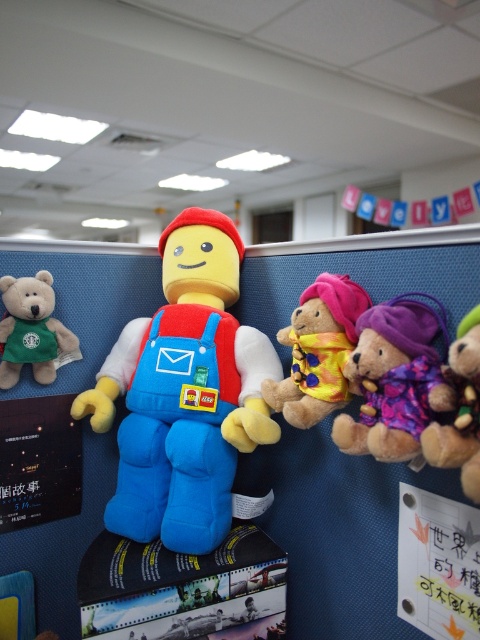
Can you confirm if fluffy yellow teddy bear at center is positioned above green fabric teddy bear at left?

No, fluffy yellow teddy bear at center is not above green fabric teddy bear at left.

The width and height of the screenshot is (480, 640). Identify the location of fluffy yellow teddy bear at center. pyautogui.click(x=317, y=349).

Find the location of a particular element. This screenshot has width=480, height=640. fluffy yellow teddy bear at center is located at coordinates (317, 349).

Is brown plush bear at right smaller than purple fuzzy teddy bear at right?

No, brown plush bear at right is not smaller than purple fuzzy teddy bear at right.

Is brown plush bear at right to the right of purple fuzzy teddy bear at right from the viewer's perspective?

Incorrect, brown plush bear at right is not on the right side of purple fuzzy teddy bear at right.

Describe the element at coordinates (395, 380) in the screenshot. This screenshot has width=480, height=640. I see `brown plush bear at right` at that location.

You are a GUI agent. You are given a task and a screenshot of the screen. Output one action in this format:
    pyautogui.click(x=<x>, y=<y>)
    Task: Click on the brown plush bear at right
    The image size is (480, 640).
    Given the screenshot: What is the action you would take?
    pyautogui.click(x=395, y=380)

From the picture: Does soft plush toy at center have a larger size compared to fluffy yellow teddy bear at center?

Correct, soft plush toy at center is larger in size than fluffy yellow teddy bear at center.

Where is `soft plush toy at center`? soft plush toy at center is located at coordinates (184, 394).

You are a GUI agent. You are given a task and a screenshot of the screen. Output one action in this format:
    pyautogui.click(x=<x>, y=<y>)
    Task: Click on the soft plush toy at center
    
    Given the screenshot: What is the action you would take?
    pyautogui.click(x=184, y=394)